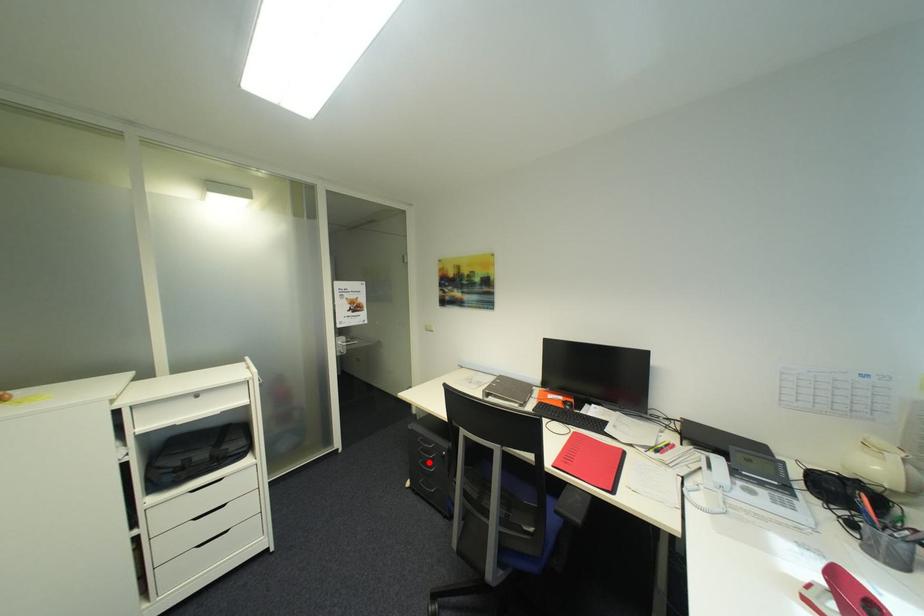
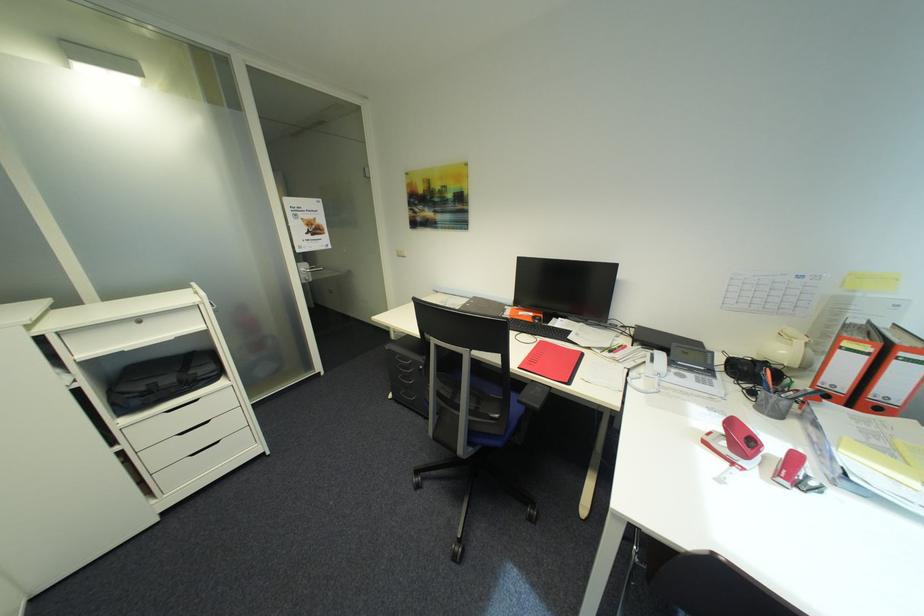
Question: I am providing you with two images of the same scene from different viewpoints. A red point is shown in image1. For the corresponding object point in image2, is it positioned nearer or farther from the camera?

Choices:
 (A) Nearer
 (B) Farther

Answer: (B)